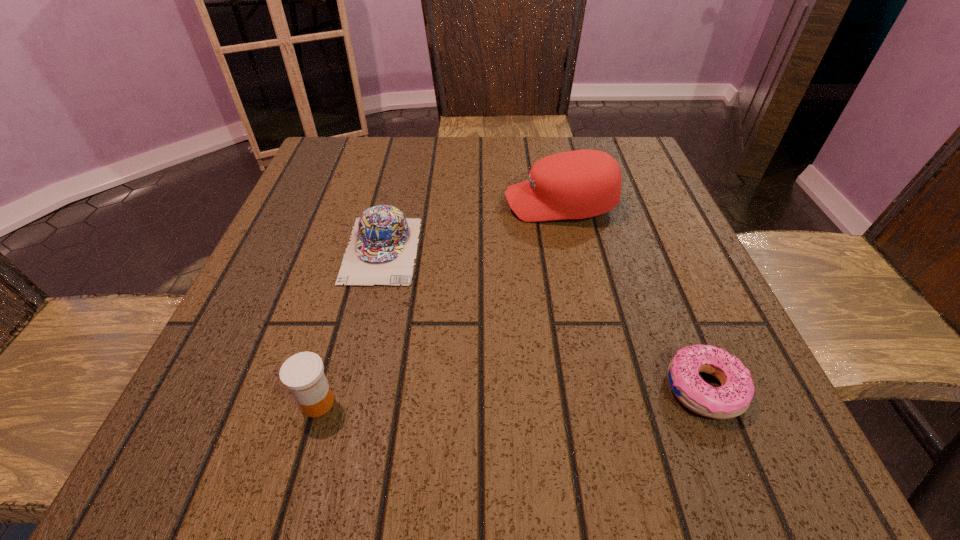
Identify the location of free space located 0.070m on the front, side, and top of the third tallest object. This screenshot has width=960, height=540. (366, 319).

At what (x,y) coordinates should I click in order to perform the action: click on blank space located 0.260m on the left of the shortest object. Please return your answer as a coordinate pair (x, y). Image resolution: width=960 pixels, height=540 pixels. Looking at the image, I should click on (479, 388).

This screenshot has width=960, height=540. I want to click on object located at the far edge, so click(x=579, y=184).

At what (x,y) coordinates should I click in order to perform the action: click on medicine that is at the near edge. Please return your answer as a coordinate pair (x, y). The image size is (960, 540). Looking at the image, I should click on (303, 373).

Where is `doughnut present at the near edge`? doughnut present at the near edge is located at coordinates (733, 398).

Where is `medicine present at the left edge`? This screenshot has height=540, width=960. medicine present at the left edge is located at coordinates (303, 373).

This screenshot has width=960, height=540. In order to click on cap present at the left edge in this screenshot , I will do `click(382, 249)`.

Where is `cap that is at the right edge`? cap that is at the right edge is located at coordinates (579, 184).

At what (x,y) coordinates should I click in order to perform the action: click on doughnut that is positioned at the right edge. Please return your answer as a coordinate pair (x, y). Looking at the image, I should click on (733, 398).

At what (x,y) coordinates should I click in order to perform the action: click on object present at the near left corner. Please return your answer as a coordinate pair (x, y). Image resolution: width=960 pixels, height=540 pixels. Looking at the image, I should click on (303, 373).